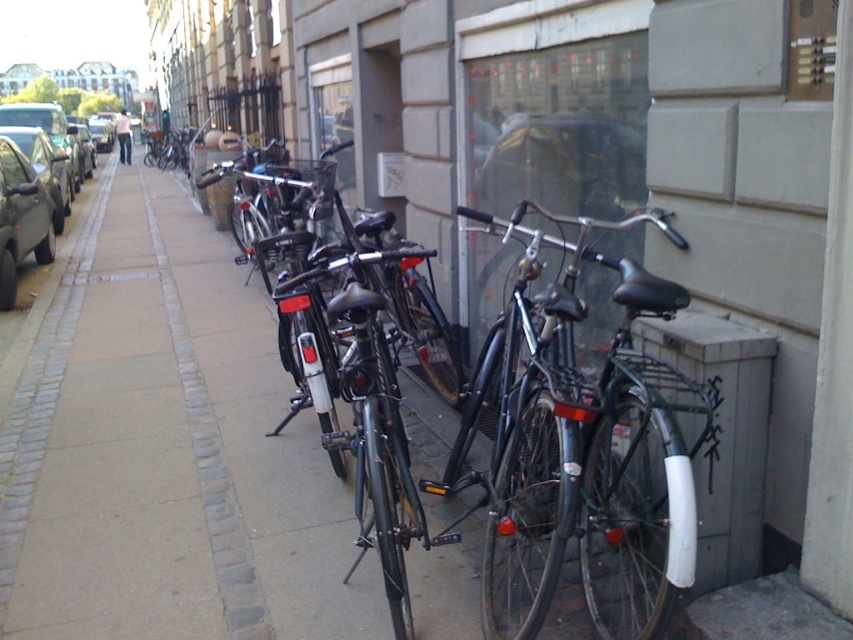
Between shiny silver car at left and matte black car at left, which one has more height?

shiny silver car at left

Is shiny silver car at left bigger than matte black car at left?

Yes, shiny silver car at left is bigger than matte black car at left.

Describe the element at coordinates (32, 186) in the screenshot. I see `shiny silver car at left` at that location.

Where is `shiny silver car at left`? shiny silver car at left is located at coordinates (32, 186).

Is point (556, 392) positioned before point (0, 125)?

Yes, point (556, 392) is closer to viewer.

Which is above, shiny black bicycle at center or shiny silver car at left?

Positioned higher is shiny silver car at left.

Who is more distant from viewer, (x=689, y=502) or (x=68, y=198)?

Point (x=68, y=198)

Identify the location of shiny black bicycle at center. (519, 436).

Can you confirm if shiny black bicycle at center is smaller than matte black car at left?

Incorrect, shiny black bicycle at center is not smaller in size than matte black car at left.

Between point (618, 592) and point (39, 204), which one is positioned in front?

Point (618, 592) is in front.

Identify the location of shiny black bicycle at center. (519, 436).